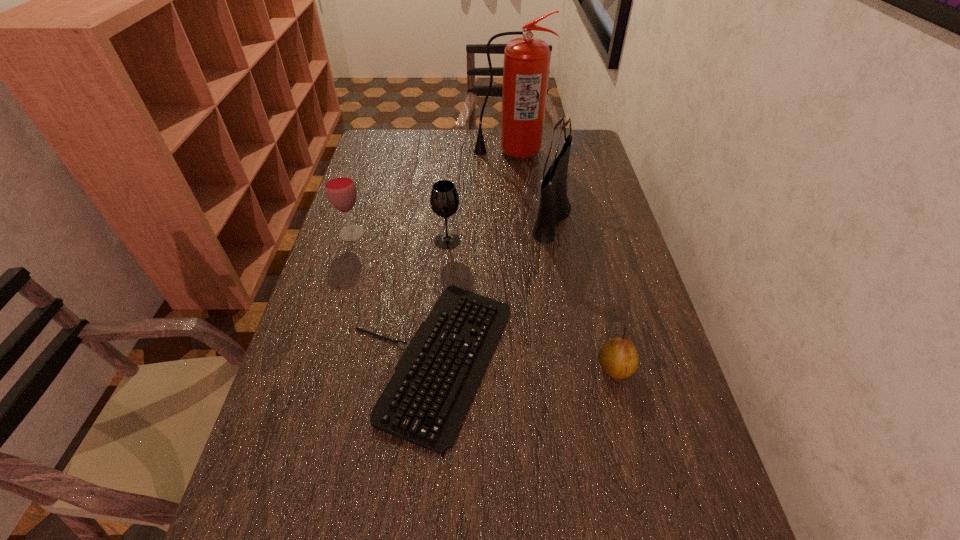
You are a GUI agent. You are given a task and a screenshot of the screen. Output one action in this format:
    pyautogui.click(x=<x>, y=<y>)
    Task: Click on the unoccupied area between the pear and the computer keyboard
    The image size is (960, 540).
    Given the screenshot: What is the action you would take?
    pyautogui.click(x=523, y=364)

At what (x,y) coordinates should I click in order to perform the action: click on unoccupied position between the pear and the shoulder bag. Please return your answer as a coordinate pair (x, y). This screenshot has width=960, height=540. Looking at the image, I should click on (584, 293).

Locate an element on the screen. The image size is (960, 540). object that is the second closest one to the fire extinguisher is located at coordinates (444, 200).

The width and height of the screenshot is (960, 540). Find the location of `object that is the closest one to the right wineglass`. object that is the closest one to the right wineglass is located at coordinates (425, 402).

At what (x,y) coordinates should I click in order to perform the action: click on vacant space that satisfies the following two spatial constraints: 1. on the back side of the computer keyboard; 2. on the left side of the shoulder bag. Please return your answer as a coordinate pair (x, y). The height and width of the screenshot is (540, 960). Looking at the image, I should click on (444, 217).